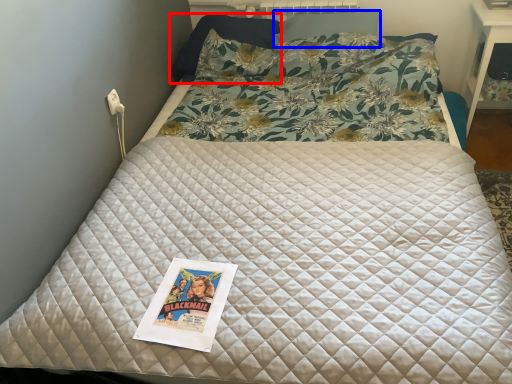
Question: Among these objects, which one is nearest to the camera, pillow (highlighted by a red box) or pillow (highlighted by a blue box)?

Choices:
 (A) pillow
 (B) pillow

Answer: (B)